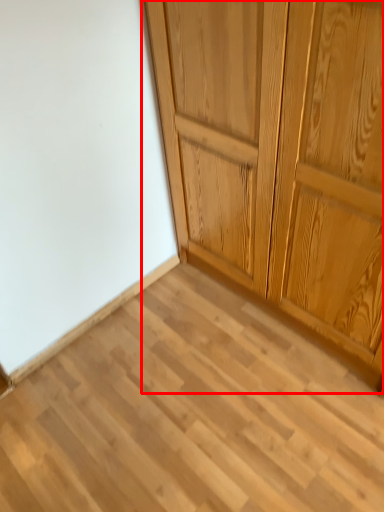
Question: In this image, where is cupboard (annotated by the red box) located relative to plank?

Choices:
 (A) right
 (B) left

Answer: (A)